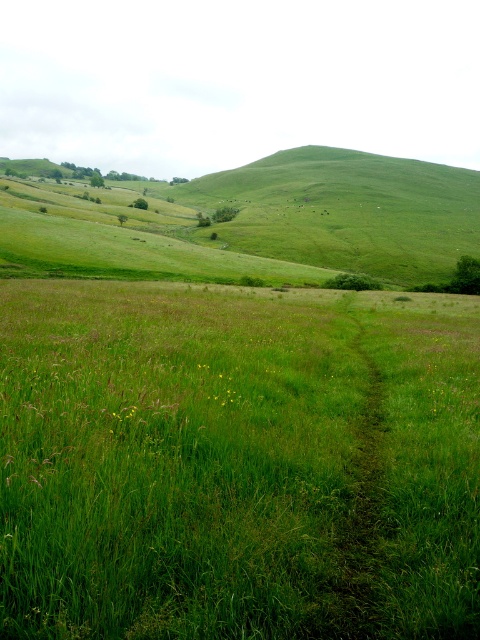
Question: Does green grassy field at center have a larger size compared to green grassy trail at center?

Choices:
 (A) yes
 (B) no

Answer: (A)

Question: Among these objects, which one is nearest to the camera?

Choices:
 (A) green grassy field at center
 (B) green grassy trail at center

Answer: (A)

Question: Can you confirm if green grassy field at center is positioned to the right of green grassy trail at center?

Choices:
 (A) yes
 (B) no

Answer: (B)

Question: Is the position of green grassy field at center less distant than that of green grassy trail at center?

Choices:
 (A) yes
 (B) no

Answer: (A)